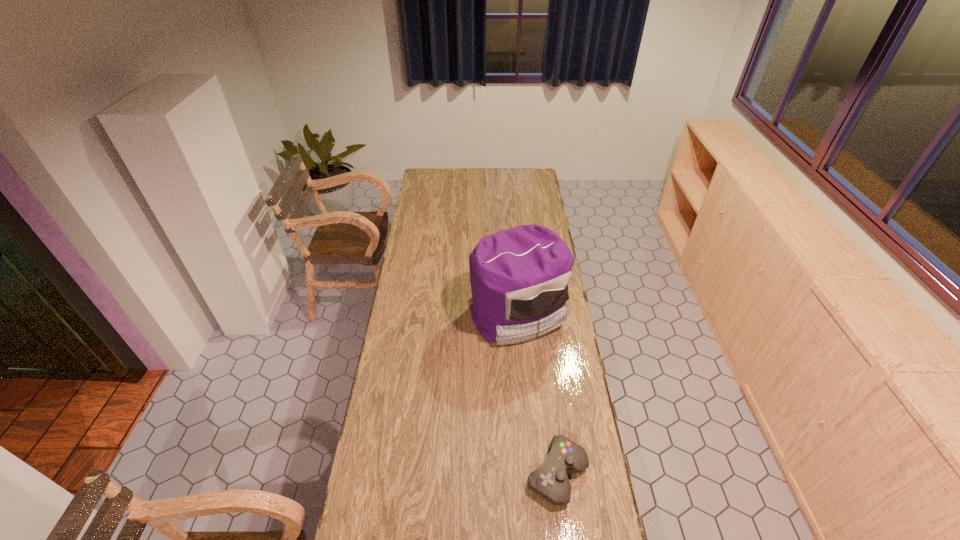
The image size is (960, 540). I want to click on backpack, so click(519, 277).

At what (x,y) coordinates should I click in order to perform the action: click on the farther object. Please return your answer as a coordinate pair (x, y). This screenshot has height=540, width=960. Looking at the image, I should click on (519, 277).

Where is `the nearer object`? the nearer object is located at coordinates (550, 481).

This screenshot has height=540, width=960. Find the location of `control`. control is located at coordinates (550, 481).

This screenshot has height=540, width=960. I want to click on vacant space situated 0.140m on the front pocket of the farther object, so click(x=523, y=383).

Where is `vacant area situated 0.200m on the back of the control`? vacant area situated 0.200m on the back of the control is located at coordinates (546, 392).

Image resolution: width=960 pixels, height=540 pixels. What are the coordinates of `backpack located at the right edge` in the screenshot? It's located at (519, 277).

The height and width of the screenshot is (540, 960). I want to click on control present at the right edge, so click(550, 481).

This screenshot has height=540, width=960. In the image, there is a desktop. In order to click on vacant space at the far edge in this screenshot , I will do `click(457, 173)`.

Find the location of a particular element. The height and width of the screenshot is (540, 960). vacant space at the left edge of the desktop is located at coordinates (418, 330).